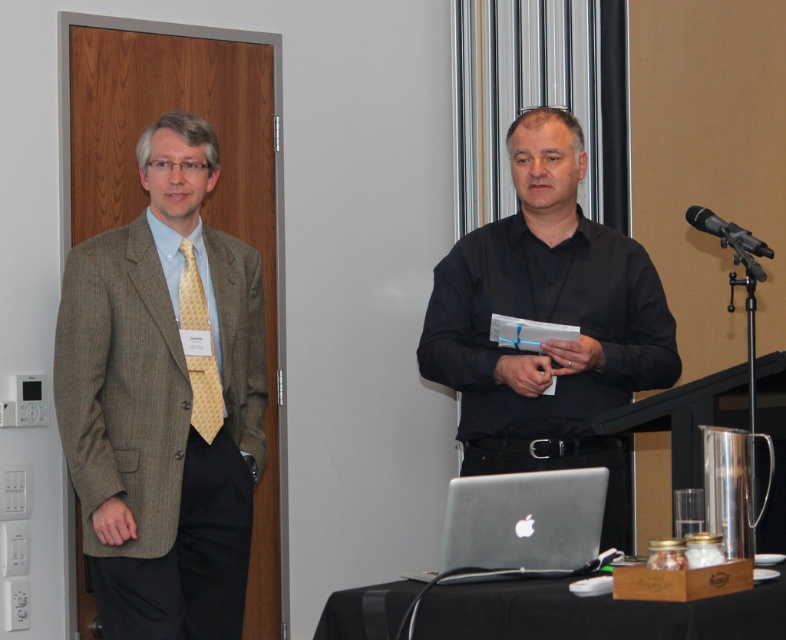
You are organizing a conference and need to ensure that all items are visible to the audience. Given the yellowgeometric patterned fabrictie at left and the black metallic microphone at upper right, which item would be more noticeable from a distance?

The yellowgeometric patterned fabrictie at left is larger in size than the black metallic microphone at upper right, making it more noticeable from a distance.

You are standing in the room and want to walk towards the black matte shirt at center. What direction should you move in relative to the door on the left side of the frame?

The black matte shirt at center is positioned at point (x=549, y=321), so you should move towards the center of the room away from the door on the left side of the frame.